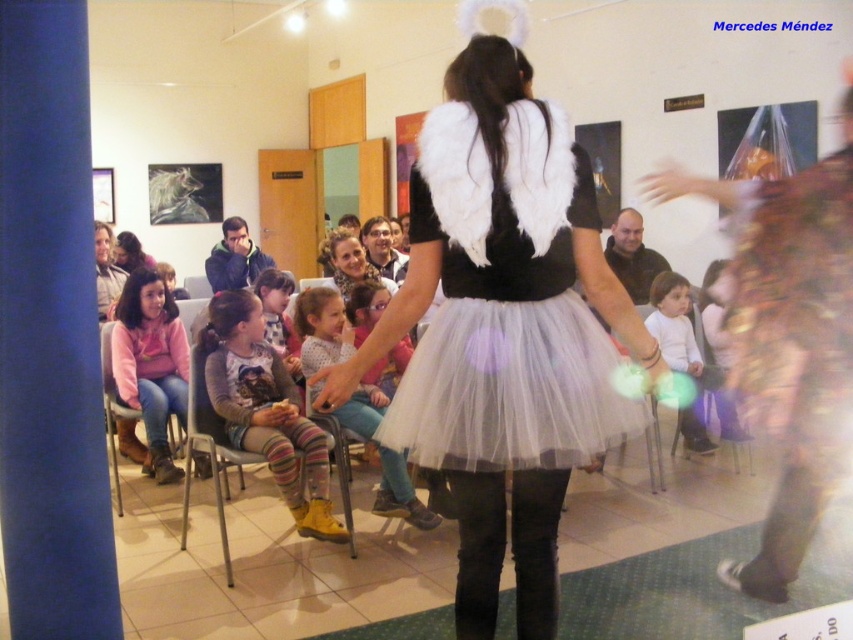
Can you confirm if white tulle skirt at center is shorter than striped wool leggings at center?

Indeed, white tulle skirt at center has a lesser height compared to striped wool leggings at center.

Is white tulle skirt at center further to camera compared to striped wool leggings at center?

That is False.

Locate an element on the screen. The width and height of the screenshot is (853, 640). white tulle skirt at center is located at coordinates (511, 388).

The height and width of the screenshot is (640, 853). In order to click on white fluffy wings at center in this screenshot , I will do `click(503, 330)`.

Can you confirm if white fluffy wings at center is wider than gold sequined dress at center?

Yes.

Who is more distant from viewer, [560,189] or [830,465]?

The point [830,465] is more distant.

The image size is (853, 640). Find the location of `white fluffy wings at center`. white fluffy wings at center is located at coordinates (503, 330).

Which is more to the right, white fluffy wings at center or white fluffy tutu at center?

Answer: white fluffy tutu at center

From the picture: Who is more distant from viewer, (473, 250) or (691, 433)?

Positioned behind is point (691, 433).

At what (x,y) coordinates should I click in order to perform the action: click on white fluffy wings at center. Please return your answer as a coordinate pair (x, y). Looking at the image, I should click on pos(503,330).